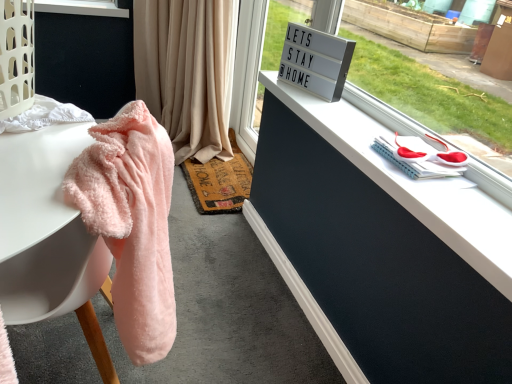
Where is `free location above rustic woven mat at center (from a real-world perspective)`? The image size is (512, 384). free location above rustic woven mat at center (from a real-world perspective) is located at coordinates (222, 174).